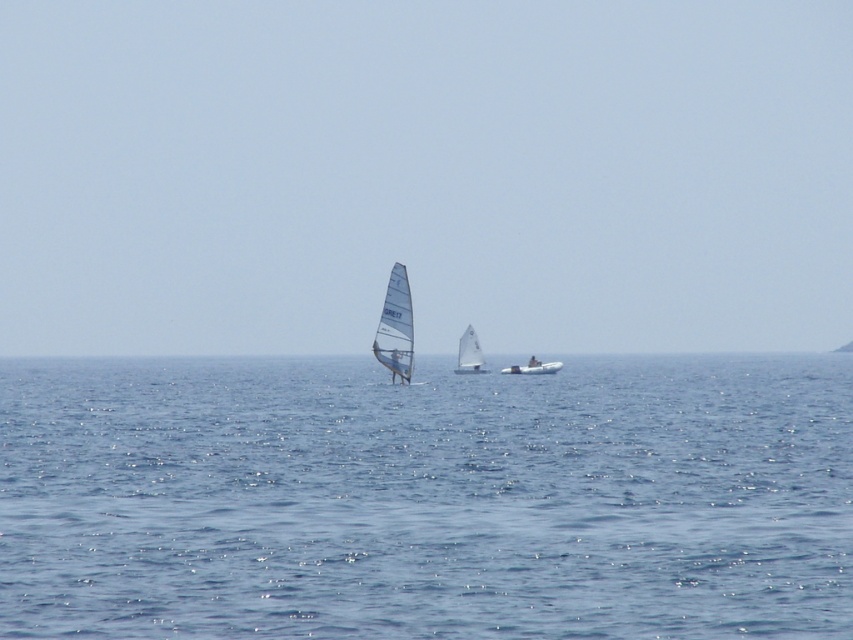
You are standing on the shore and see two boats in the water. The white matte sailboat at center and the white matte dinghy at center. Which one is positioned more to the left?

The white matte sailboat at center is positioned more to the left than the white matte dinghy at center.

You are standing on a cliff overlooking the serene seascape described. You notice the transparent sailboat at center. Based on its position, can you determine if it is closer to the horizon or the cliff?

The transparent sailboat at center is located at point coordinates closer to the horizon than the cliff, so it is closer to the horizon.

You are a photographer aiming to capture both the transparent sailboat at center and the white matte sailboat at center in a single shot. Based on their positions, which sailboat will appear closer to the camera in the photo?

The transparent sailboat at center is positioned over the white matte sailboat at center, so it will appear closer to the camera in the photo.